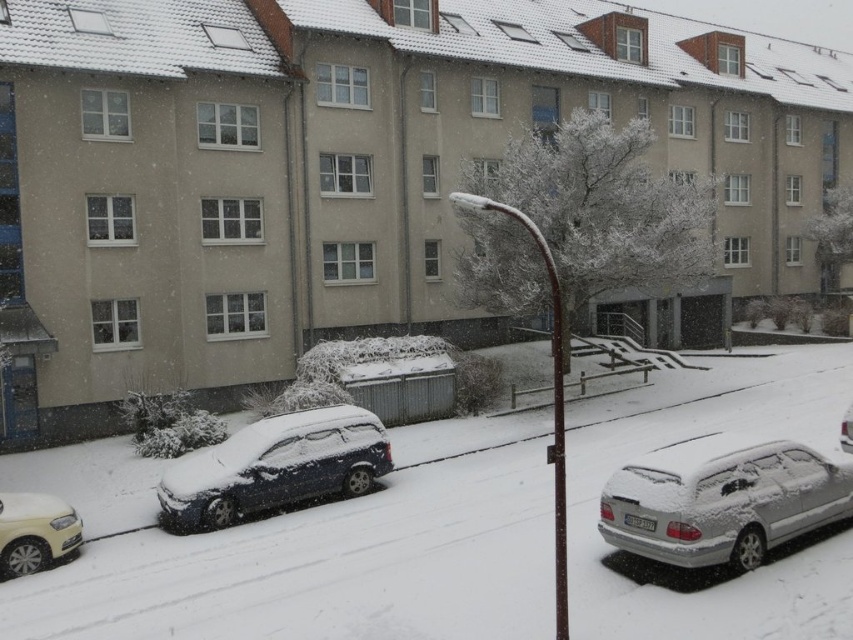
You are standing at point [276,467] and want to walk to the nearest parked car. Which direction should you go?

The nearest parked car is the sleek metallic car at left, so you should walk to the left from point [276,467].

You are standing at the center of the snowy street and want to locate the silver metallic car at lower right. According to the coordinates provided, in which direction should you look to find it?

The silver metallic car at lower right is located at coordinates point (722, 499), so you should look to your lower right direction to find it.

You are a delivery person trying to park your van between the silver metallic car at lower right and the matte white car at lower left. Based on their positions, can you fit your van, which is 6 meters long, between them?

The silver metallic car at lower right is closer to the viewer than the matte white car at lower left. Without knowing the exact distance between them, it is impossible to determine if the van will fit. Please measure the space before attempting to park.